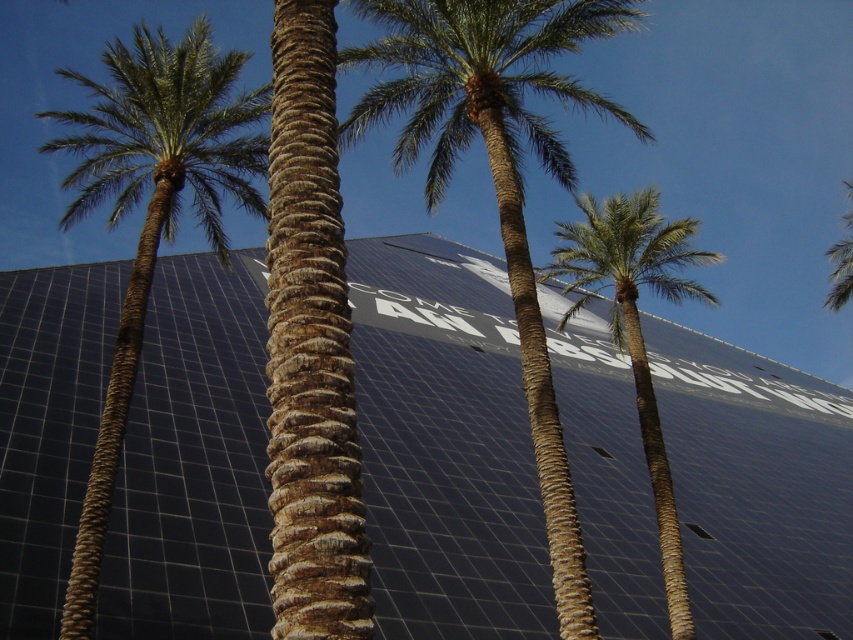
You are a photographer trying to capture the entire scene of the black glass building at center and the green leafy palm at center in one shot. Based on their sizes, which one might require you to adjust your camera angle to fit into the frame?

The black glass building at center has a smaller size compared to the green leafy palm at center, so the photographer might need to adjust the camera angle to accommodate the larger green leafy palm at center in the frame.

You are standing in front of the architectural structure with the dark blue facade. There is a green leafy palm tree at left. Can you see the palm tree from your current position?

Yes, the green leafy palm tree at left is located at point (151, 211), so you can see it from your current position in front of the architectural structure.

You are standing at the origin point of the coordinate system. You want to walk to the black glass building at center. Which direction should you go?

Since the black glass building at center is located at coordinate point (445, 444), you should move in the positive x and y direction to reach it.